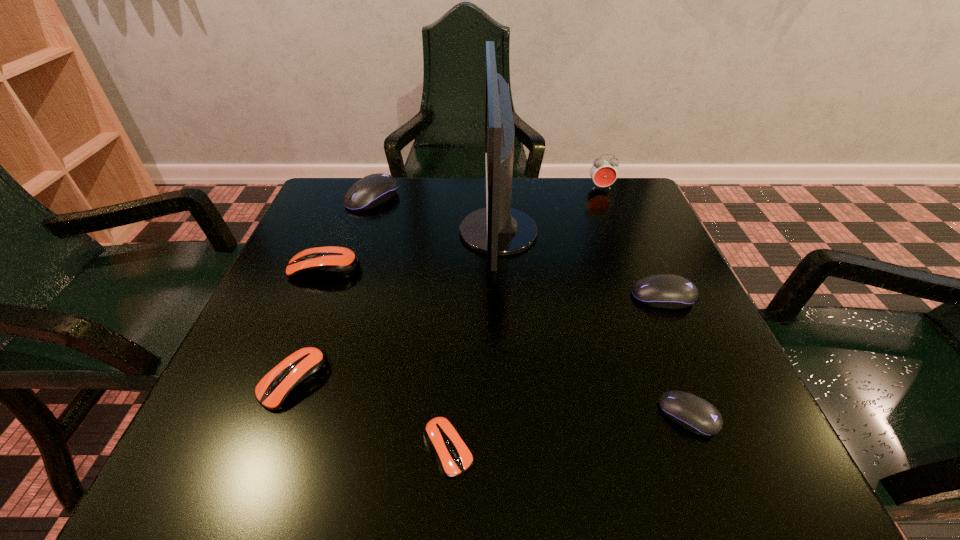
Locate an element on the screen. blank space located 0.110m on the back of the second smallest orange computer mouse is located at coordinates (321, 307).

Identify the location of vacant space located on the back of the smallest black computer mouse. (627, 256).

Where is `vacant space positioned 0.250m on the left of the rightmost orange computer mouse`? The height and width of the screenshot is (540, 960). vacant space positioned 0.250m on the left of the rightmost orange computer mouse is located at coordinates (247, 448).

Image resolution: width=960 pixels, height=540 pixels. What are the coordinates of `monitor present at the far edge` in the screenshot? It's located at (495, 230).

Find the location of a particular element. The width and height of the screenshot is (960, 540). alarm clock located in the far edge section of the desktop is located at coordinates (603, 173).

At what (x,y) coordinates should I click in order to perform the action: click on computer mouse that is positioned at the far edge. Please return your answer as a coordinate pair (x, y). This screenshot has width=960, height=540. Looking at the image, I should click on (372, 190).

At what (x,y) coordinates should I click in order to perform the action: click on alarm clock at the right edge. Please return your answer as a coordinate pair (x, y). The height and width of the screenshot is (540, 960). Looking at the image, I should click on (603, 173).

This screenshot has height=540, width=960. I want to click on object positioned at the far left corner, so click(372, 190).

Where is `object that is at the far right corner`? object that is at the far right corner is located at coordinates (603, 173).

Image resolution: width=960 pixels, height=540 pixels. I want to click on object positioned at the near right corner, so click(x=696, y=415).